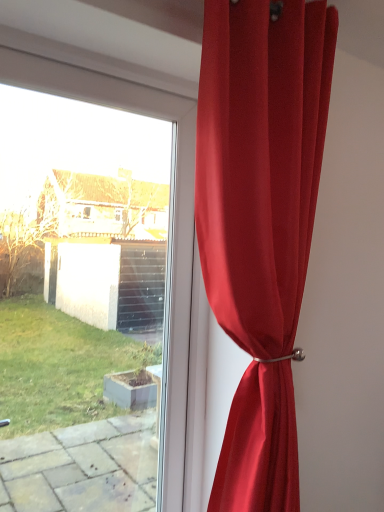
Question: From the image's perspective, is satin red curtain at right located above or below transparent glass window at upper left?

Choices:
 (A) below
 (B) above

Answer: (B)

Question: Choose the correct answer: Is satin red curtain at right inside transparent glass window at upper left or outside it?

Choices:
 (A) inside
 (B) outside

Answer: (B)

Question: From a real-world perspective, is satin red curtain at right positioned above or below transparent glass window at upper left?

Choices:
 (A) above
 (B) below

Answer: (A)

Question: Looking at their shapes, would you say transparent glass window at upper left is wider or thinner than satin red curtain at right?

Choices:
 (A) thin
 (B) wide

Answer: (A)

Question: Is transparent glass window at upper left bigger or smaller than satin red curtain at right?

Choices:
 (A) big
 (B) small

Answer: (B)

Question: Considering the positions of point (180, 337) and point (208, 226), is point (180, 337) closer or farther from the camera than point (208, 226)?

Choices:
 (A) farther
 (B) closer

Answer: (A)

Question: In the image, is transparent glass window at upper left on the left side or the right side of satin red curtain at right?

Choices:
 (A) left
 (B) right

Answer: (A)